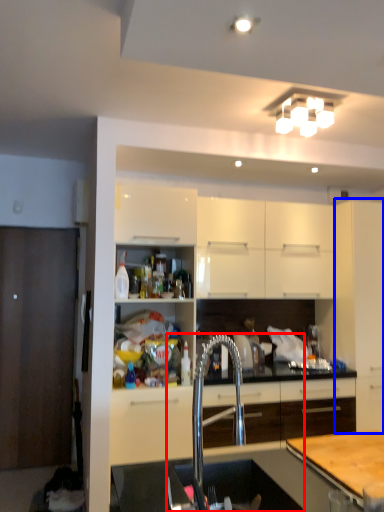
Question: Among these objects, which one is farthest to the camera, sink (highlighted by a red box) or cabinetry (highlighted by a blue box)?

Choices:
 (A) sink
 (B) cabinetry

Answer: (B)